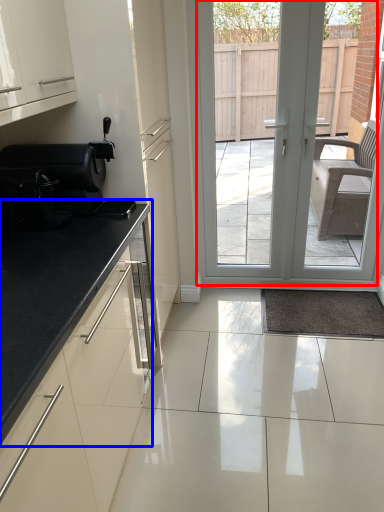
Question: Which object is closer to the camera taking this photo, door (highlighted by a red box) or countertop (highlighted by a blue box)?

Choices:
 (A) door
 (B) countertop

Answer: (B)